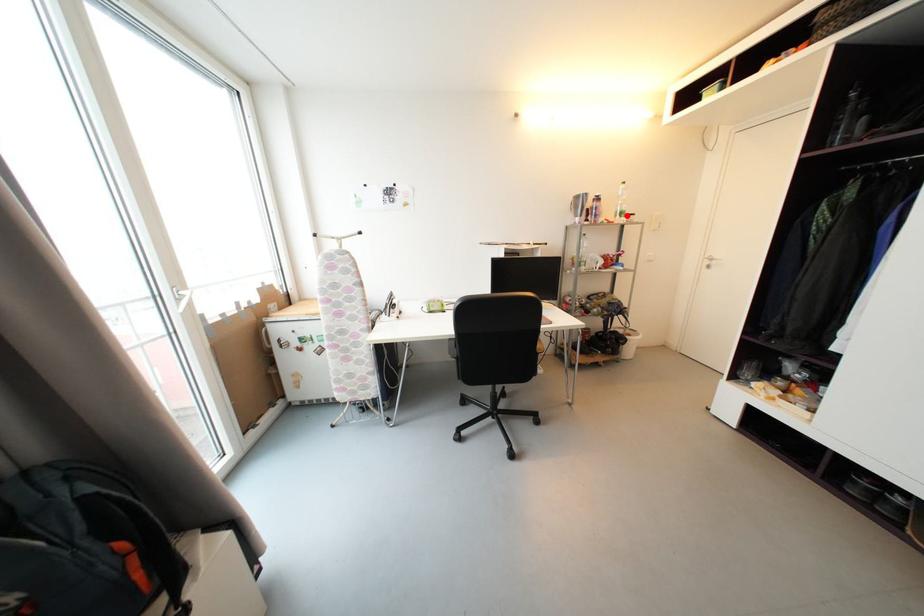
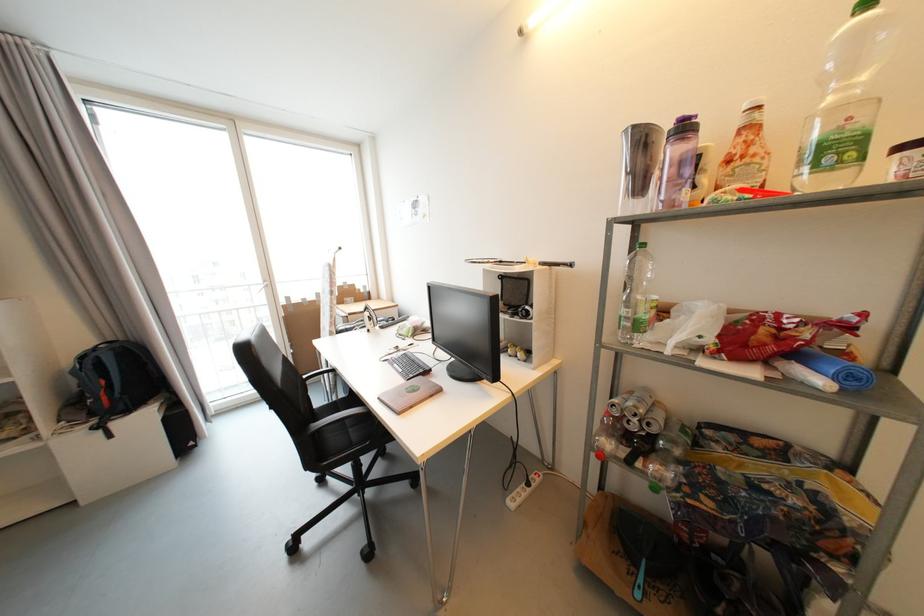
The point at the highlighted location is marked in the first image. Where is the corresponding point in the second image?

(842, 151)